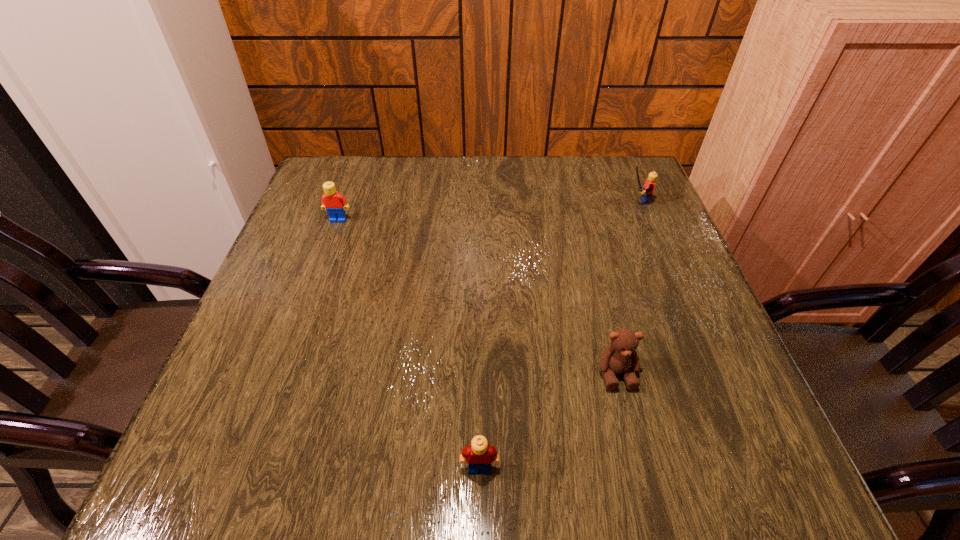
Identify the location of the farthest Lego. Image resolution: width=960 pixels, height=540 pixels. (646, 193).

Identify the location of the rightmost Lego. click(x=646, y=193).

Locate an element on the screen. This screenshot has width=960, height=540. the second farthest Lego is located at coordinates (335, 204).

Where is `the leftmost Lego`? the leftmost Lego is located at coordinates tap(335, 204).

Where is `the second object from right to left`? The width and height of the screenshot is (960, 540). the second object from right to left is located at coordinates (620, 357).

Image resolution: width=960 pixels, height=540 pixels. I want to click on teddy bear, so click(x=620, y=357).

At what (x,y) coordinates should I click in order to perform the action: click on the shortest Lego. Please return your answer as a coordinate pair (x, y). Looking at the image, I should click on (479, 454).

At what (x,y) coordinates should I click in order to perform the action: click on the nearest Lego. Please return your answer as a coordinate pair (x, y). Looking at the image, I should click on (479, 454).

At what (x,y) coordinates should I click in order to perform the action: click on vacant space situated 0.250m on the front-facing side of the rightmost object. Please return your answer as a coordinate pair (x, y). This screenshot has width=960, height=540. Looking at the image, I should click on (526, 201).

At what (x,y) coordinates should I click in order to perform the action: click on vacant space situated on the front-facing side of the rightmost object. Please return your answer as a coordinate pair (x, y). The image size is (960, 540). Looking at the image, I should click on (573, 201).